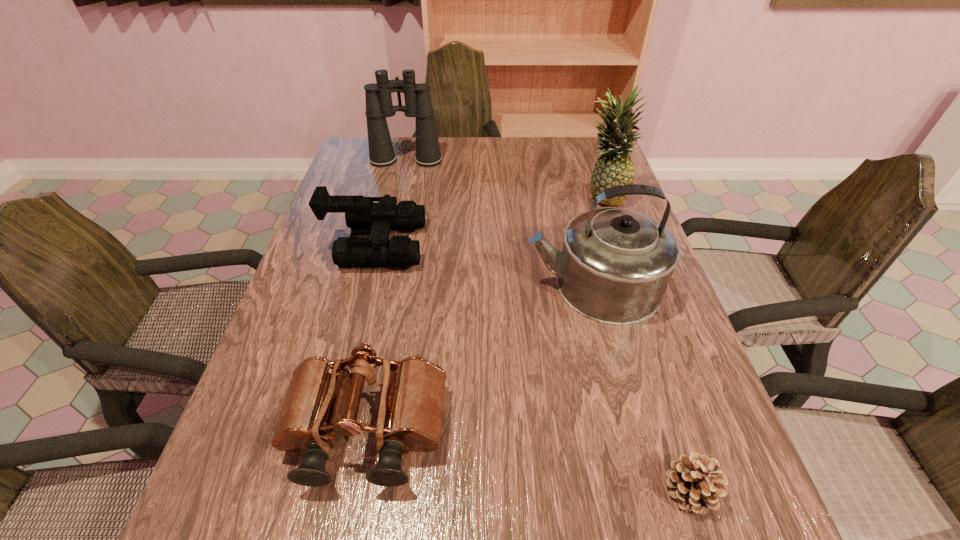
The height and width of the screenshot is (540, 960). Identify the location of vacant area that lies between the tallest binoculars and the kettle. (499, 223).

Identify which object is the fifth closest to the shortest object. Please provide its 2D coordinates. Your answer should be formatted as a tuple, i.e. [(x, y)], where the tuple contains the x and y coordinates of a point satisfying the conditions above.

[(418, 104)]

Locate which object is the fifth closest to the pineapple. Please provide its 2D coordinates. Your answer should be formatted as a tuple, i.e. [(x, y)], where the tuple contains the x and y coordinates of a point satisfying the conditions above.

[(694, 481)]

The height and width of the screenshot is (540, 960). What are the coordinates of `binoculars that is the closest one to the kettle` in the screenshot? It's located at (410, 414).

Where is `binoculars that stands as the third closest to the pinecone`? binoculars that stands as the third closest to the pinecone is located at coordinates (418, 104).

Image resolution: width=960 pixels, height=540 pixels. In order to click on vacant area that satisfies the following two spatial constraints: 1. on the front side of the fifth nearest object; 2. on the left side of the farthest object in this screenshot , I will do `click(397, 197)`.

The image size is (960, 540). I want to click on blank space that satisfies the following two spatial constraints: 1. on the front lenses of the second nearest binoculars; 2. on the right side of the pinecone, so click(312, 489).

I want to click on free location that satisfies the following two spatial constraints: 1. through the eyepieces of the nearest binoculars; 2. on the right side of the pinecone, so click(x=356, y=489).

Find the location of a particular element. This screenshot has height=540, width=960. vacant area that satisfies the following two spatial constraints: 1. with the spout at the front of the kettle; 2. on the left side of the pinecone is located at coordinates (643, 489).

Locate an element on the screen. This screenshot has height=540, width=960. free space in the image that satisfies the following two spatial constraints: 1. on the back side of the shortest object; 2. with the spout at the front of the kettle is located at coordinates (624, 285).